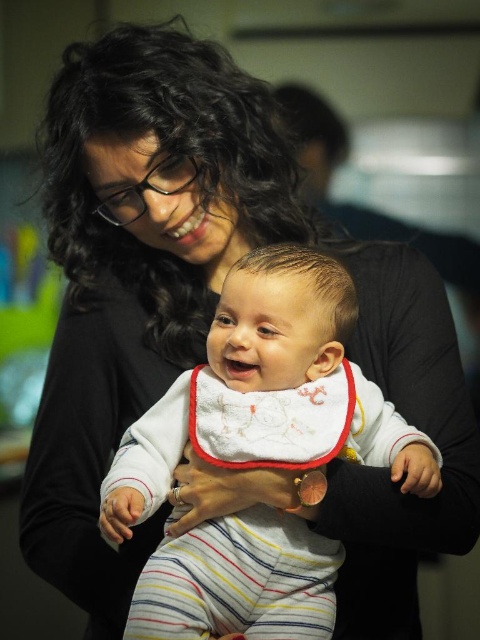
You are a photographer adjusting the focus on a camera. You notice two points in the image at coordinates point [311,536] and point [331,403]. Which point is closer to the camera lens?

Point [311,536] is further to the viewer than point [331,403], so the point closer to the camera lens is point [331,403].

You are a photographer adjusting your camera settings to focus on the white soft fabric baby at center. The camera can focus on objects within 30 inches. Will the baby be in focus?

The white soft fabric baby at center is 32.65 inches from viewer, which is beyond the camera focus range of 30 inches. The baby will not be in focus.

Looking at the scene, there is a white soft fabric baby at center and a white embroidered bib at center. Which object takes up more space in the image?

The white soft fabric baby at center is larger in size than the white embroidered bib at center, so it takes up more space in the image.